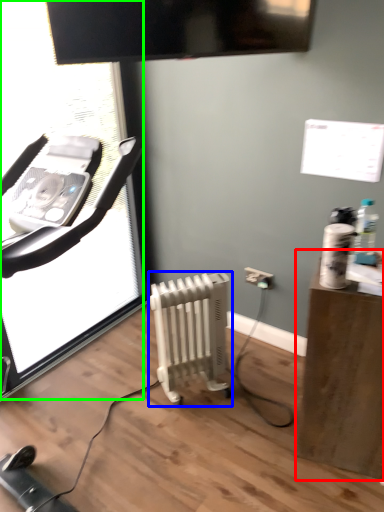
Question: Estimate the real-world distances between objects in this image. Which object is closer to furniture (highlighted by a red box), radiator (highlighted by a blue box) or screen door (highlighted by a green box)?

Choices:
 (A) radiator
 (B) screen door

Answer: (A)